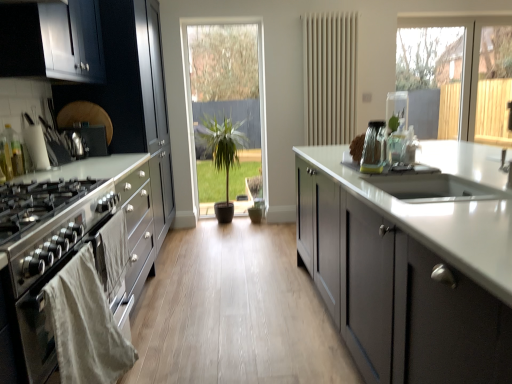
Locate an element on the screen. vacant area on top of beige matte radiator at center (from a real-world perspective) is located at coordinates (332, 3).